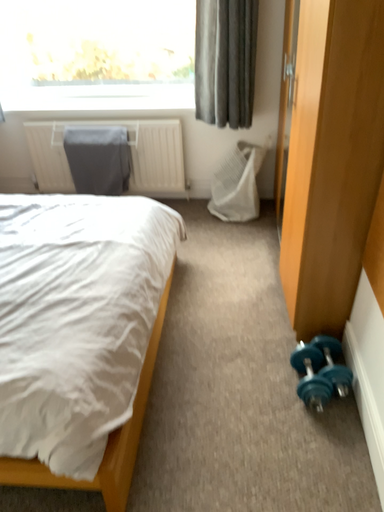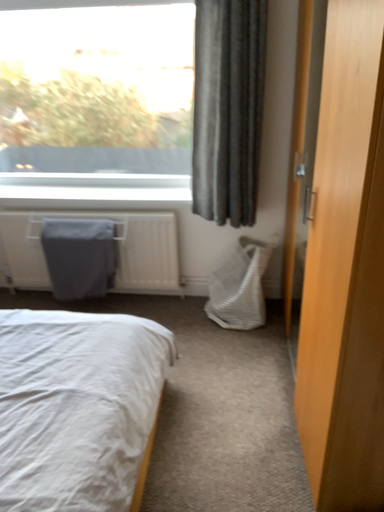
Question: Which way did the camera rotate in the video?

Choices:
 (A) rotated downward
 (B) rotated upward

Answer: (B)